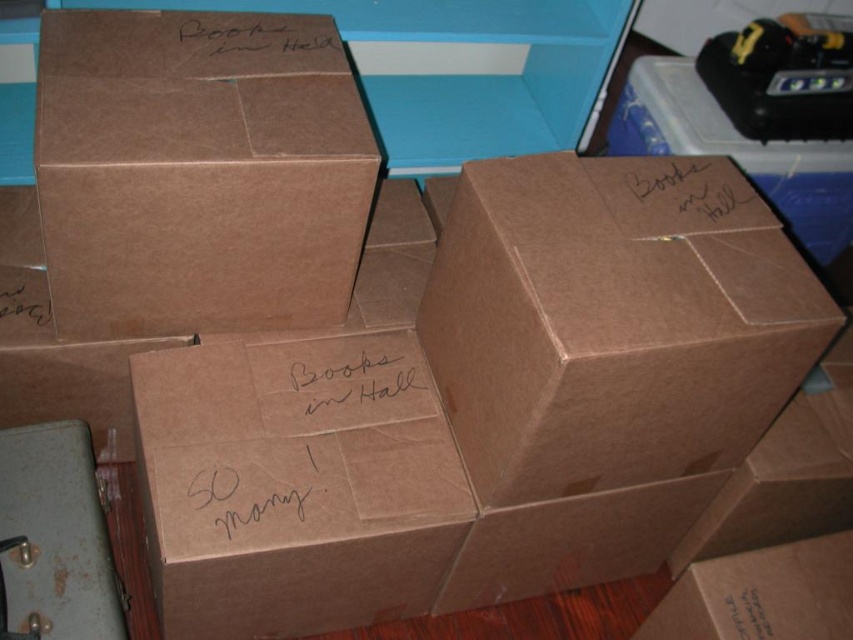
Is the position of brown cardboard box at upper left less distant than that of brown cardboard box at center?

Yes, it is.

Is point (90, 77) positioned in front of point (341, 385)?

Yes.

Between point (184, 100) and point (426, 401), which one is positioned in front?

Point (184, 100)

At what (x,y) coordinates should I click in order to perform the action: click on brown cardboard box at upper left. Please return your answer as a coordinate pair (x, y). The height and width of the screenshot is (640, 853). Looking at the image, I should click on (198, 172).

What do you see at coordinates (360, 385) in the screenshot? This screenshot has width=853, height=640. I see `brown cardboard box at center` at bounding box center [360, 385].

Which is in front, point (299, 371) or point (3, 298)?

Point (299, 371) is more forward.

At what (x,y) coordinates should I click in order to perform the action: click on brown cardboard box at center. Please return your answer as a coordinate pair (x, y). The height and width of the screenshot is (640, 853). Looking at the image, I should click on (360, 385).

Can you confirm if handwritten brown paper at upper right is positioned above black paper at upper center?

No, handwritten brown paper at upper right is not above black paper at upper center.

Can you confirm if handwritten brown paper at upper right is positioned below black paper at upper center?

Yes, handwritten brown paper at upper right is below black paper at upper center.

Between point (645, 216) and point (305, 54), which one is positioned behind?

The point (305, 54) is more distant.

Where is `handwritten brown paper at upper right`? This screenshot has height=640, width=853. handwritten brown paper at upper right is located at coordinates (689, 195).